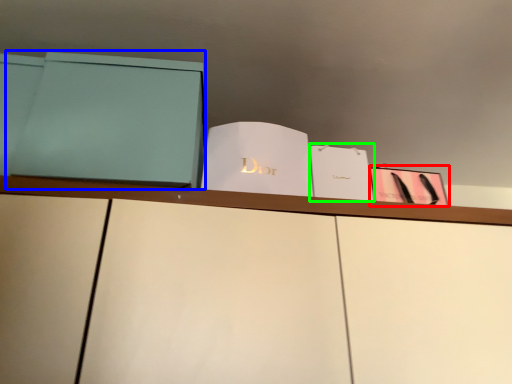
Question: Considering the real-world distances, which object is closest to paperback book (highlighted by a red box)? paperback book (highlighted by a blue box) or paperback book (highlighted by a green box).

Choices:
 (A) paperback book
 (B) paperback book

Answer: (B)